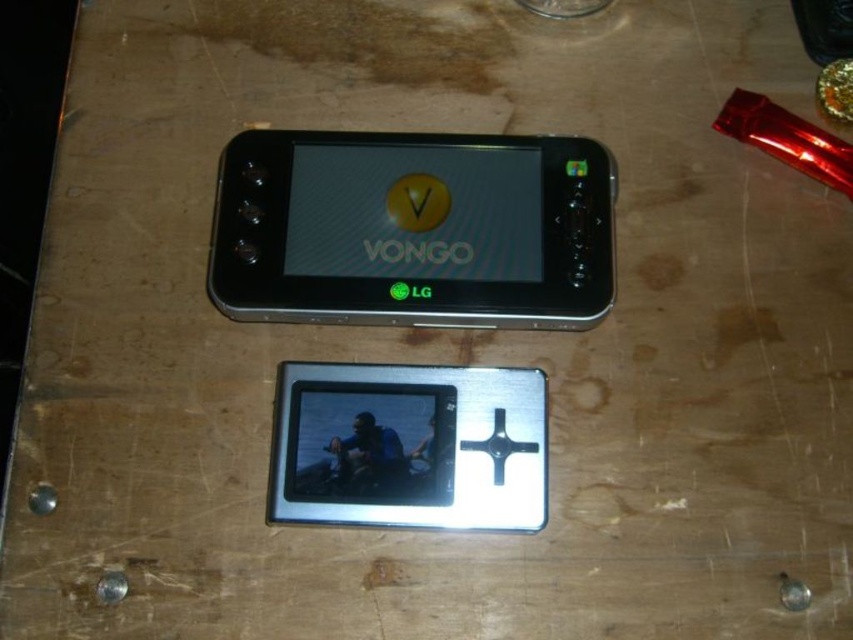
You are organizing a tech fair and need to arrange these two devices for a display. The matte black phone at center and the silver metallic media player at center must be placed side by side. If you want to follow the original arrangement, which device should be placed to the left?

The silver metallic media player at center should be placed to the left of the matte black phone at center because the matte black phone at center is positioned on the right side of the silver metallic media player at center in the original arrangement.

You are organizing a tech showcase and need to place both the matte black phone at center and the silver metallic media player at center on a shelf. The shelf has a width limit of 12 inches. If the combined width of both devices is 11 inches, will they fit together on the shelf?

The combined width of the matte black phone at center and the silver metallic media player at center is 11 inches, which is under the 12 inch limit. Therefore, they will fit together on the shelf.

You are a delivery person who needs to place a matte black phone at center on a wooden surface with visible scratches and stains. The surface has a coordinate system where the bottom left corner is the origin. The point given is point[413,228]. Can you confirm if placing the matte black phone at center at this point will ensure it is centered on the surface?

The point at [413,228] is where the matte black phone at center is located, so placing it there will center it on the surface.